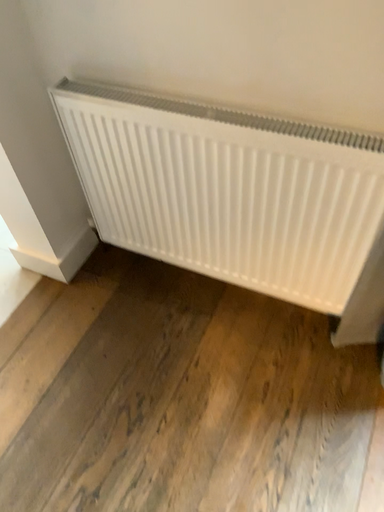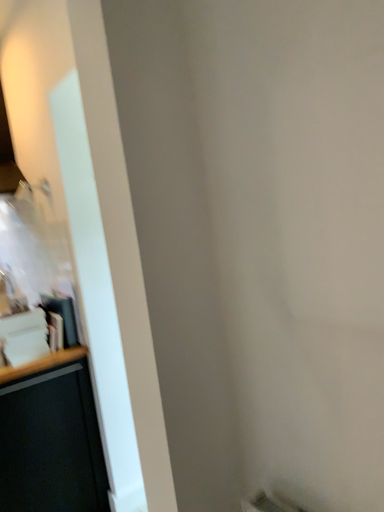
Question: How did the camera likely rotate when shooting the video?

Choices:
 (A) rotated upward
 (B) rotated downward

Answer: (A)